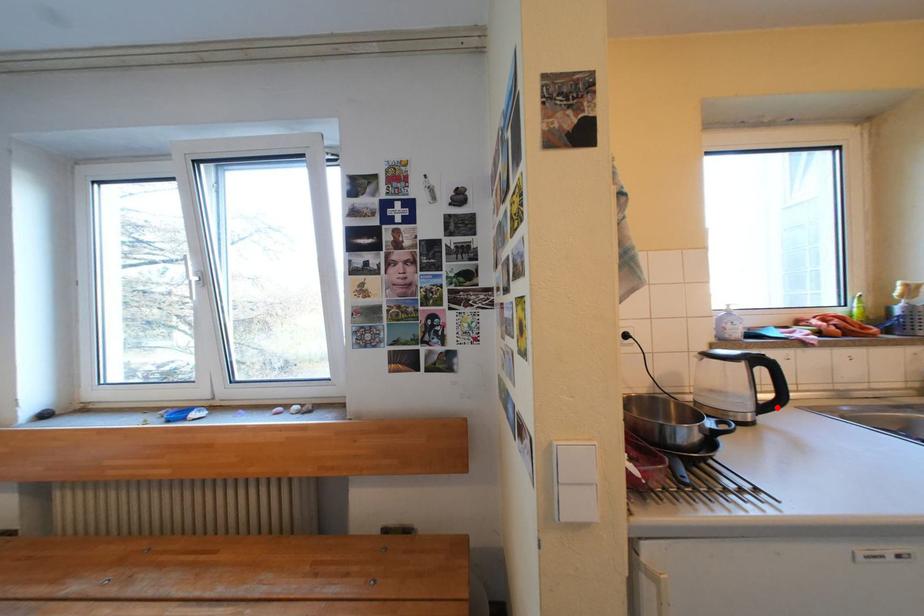
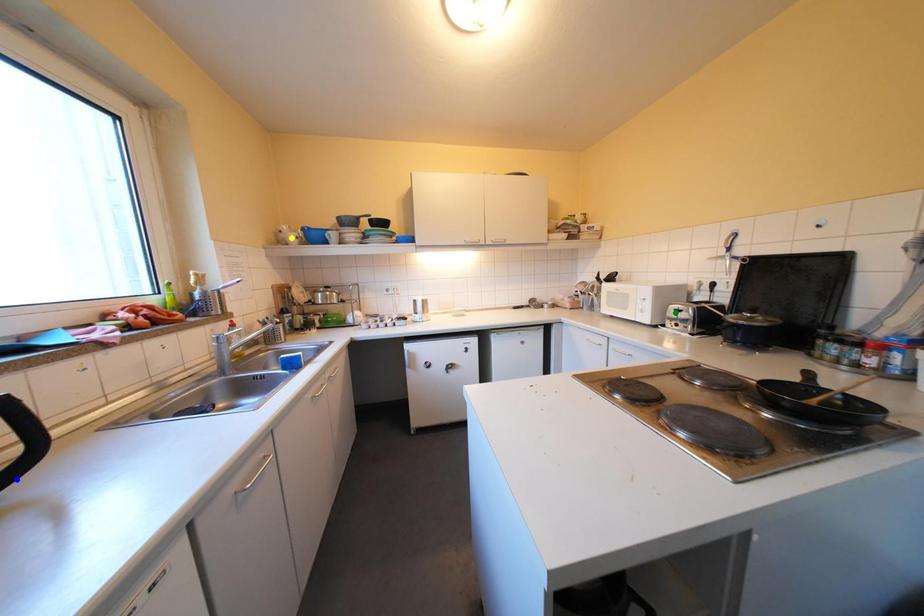
Question: I am providing you with two images of the same scene from different viewpoints. A red point is marked on the first image. You are given multiple points on the second image. Which point in image 2 is actually the same real-world point as the red point in image 1?

Choices:
 (A) yellow point
 (B) blue point
 (C) green point

Answer: (B)